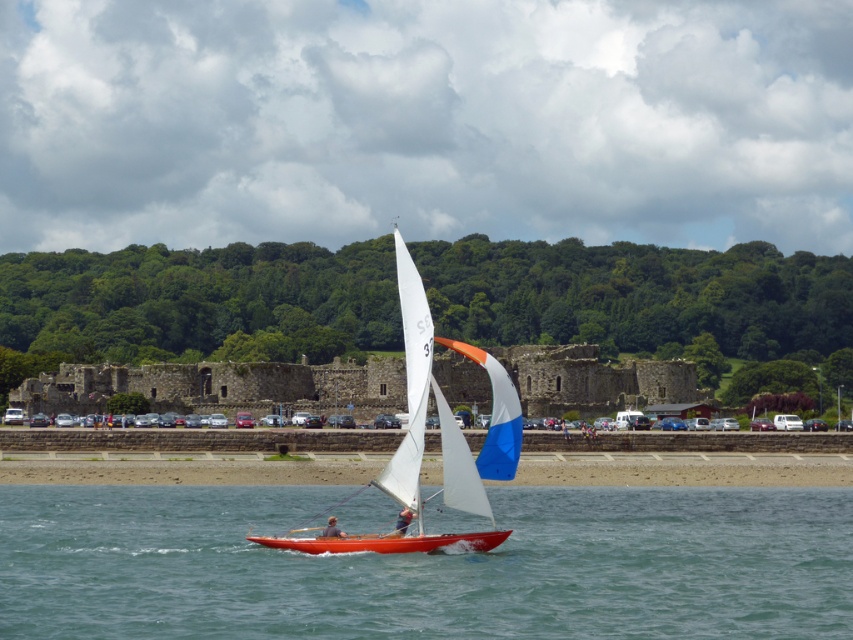
You are a photographer planning to capture the orange matte kayak at center and the clear blue water at center in a single shot. Based on their positions, which one will appear closer to the camera in the photo?

The clear blue water at center appears closer to the camera because it is positioned in front of the orange matte kayak at center.

You are standing on the deck of the red sailboat with two sails. You need to throw a lifebuoy to someone in the water at center. The lifebuoy can travel 75 meters. Will it reach the clear blue water at center?

The clear blue water at center is 76.30 meters away. The lifebuoy can only travel 75 meters, so it won not reach the clear blue water at center.

You are planning to set up a picnic area on the smooth sand beach at lower center and also want to place an orange matte kayak at center. Considering the space available, which object has a greater width?

The smooth sand beach at lower center has a greater width than the orange matte kayak at center according to the description provided.